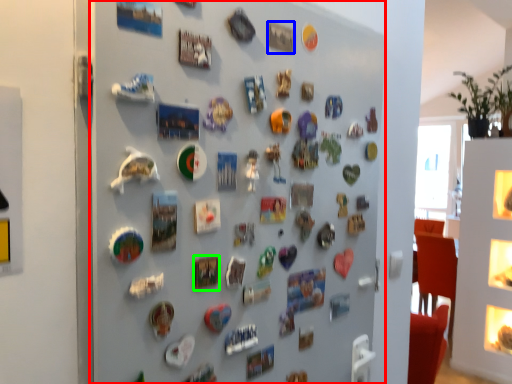
Question: Based on their relative distances, which object is farther from fireplace (highlighted by a red box)? Choose from button (highlighted by a blue box) and button (highlighted by a green box).

Choices:
 (A) button
 (B) button

Answer: (A)